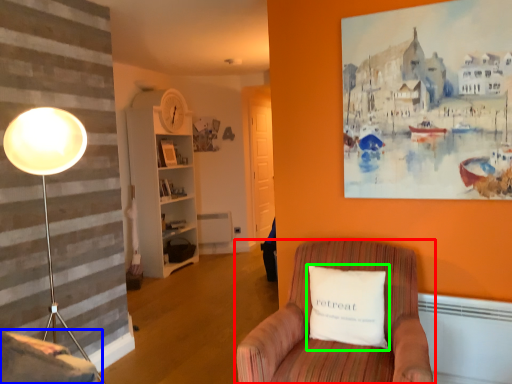
Question: Which is nearer to the chair (highlighted by a red box)? swivel chair (highlighted by a blue box) or pillow (highlighted by a green box).

Choices:
 (A) swivel chair
 (B) pillow

Answer: (B)